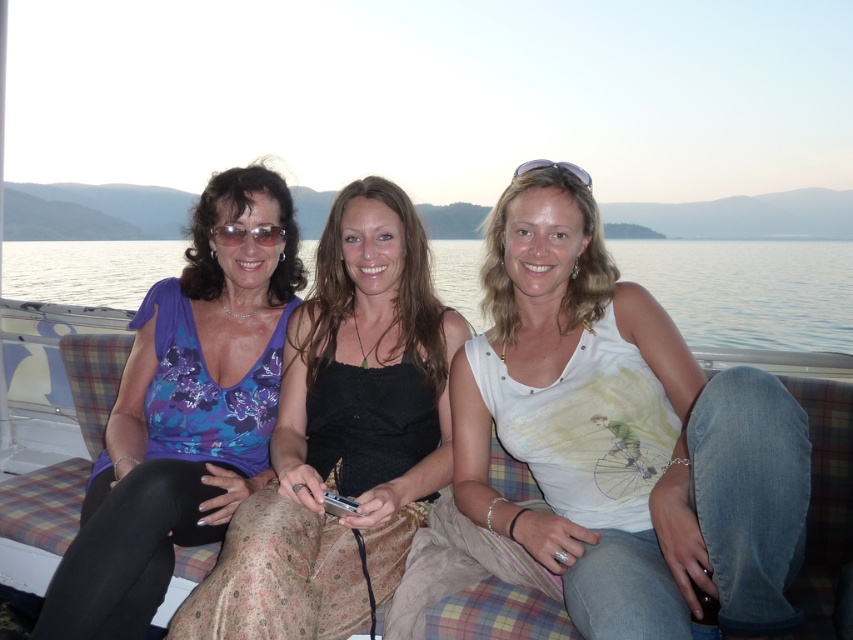
Question: Can you confirm if floral print tank top at center is wider than matte black goggles at upper center?

Choices:
 (A) yes
 (B) no

Answer: (A)

Question: Which point appears closest to the camera in this image?

Choices:
 (A) (781, 305)
 (B) (637, 588)

Answer: (B)

Question: Does clear blue water at center come behind matte black sunglasses at center?

Choices:
 (A) no
 (B) yes

Answer: (A)

Question: Which is farther from the matte black sunglasses at center?

Choices:
 (A) matte black goggles at upper center
 (B) floral print tank top at center

Answer: (A)

Question: Where is matte purple blouse at left located in relation to matte black goggles at upper center in the image?

Choices:
 (A) below
 (B) above

Answer: (A)

Question: Considering the real-world distances, which object is farthest from the white cotton tank top at center?

Choices:
 (A) clear blue water at center
 (B) matte black sunglasses at center
 (C) floral print tank top at center

Answer: (A)